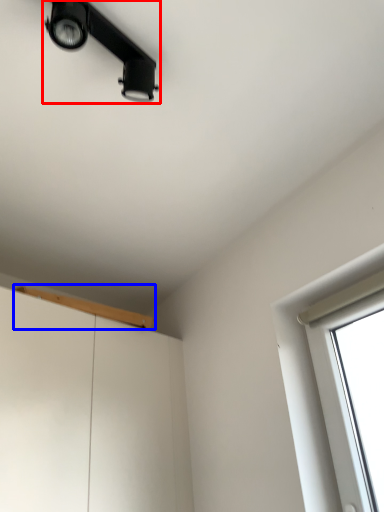
Question: Which object appears farthest to the camera in this image, lamp (highlighted by a red box) or window sill (highlighted by a blue box)?

Choices:
 (A) lamp
 (B) window sill

Answer: (B)